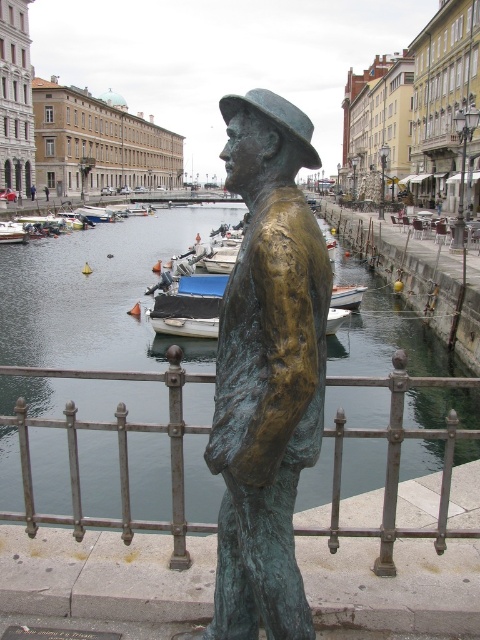
From the picture: You are a tourist in the city and want to take a photo of the bronze statue of a man by the canal. You notice two boats in the scene. Which boat, the blue matte boat at center or the white wooden boat at lower left, is closer to the statue?

The blue matte boat at center is positioned on the right side of the white wooden boat at lower left, so the white wooden boat at lower left is closer to the statue.